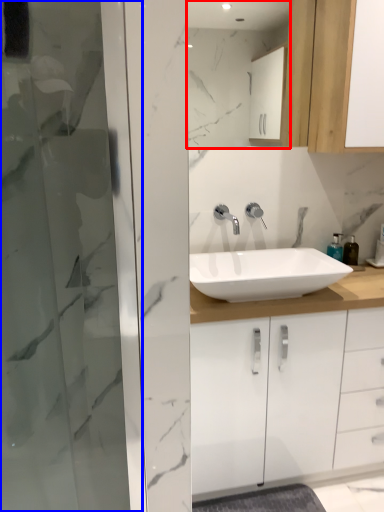
Question: Among these objects, which one is farthest to the camera, mirror (highlighted by a red box) or screen door (highlighted by a blue box)?

Choices:
 (A) mirror
 (B) screen door

Answer: (A)